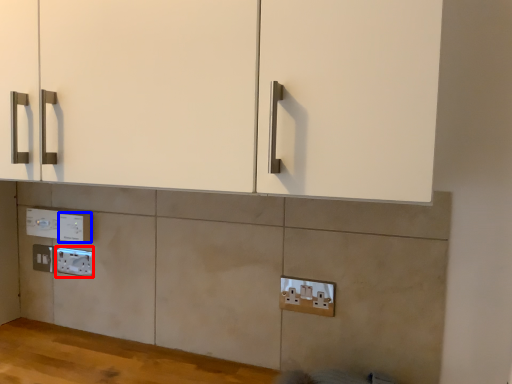
Question: Which point is closer to the camera, electric outlet (highlighted by a red box) or electric outlet (highlighted by a blue box)?

Choices:
 (A) electric outlet
 (B) electric outlet

Answer: (B)